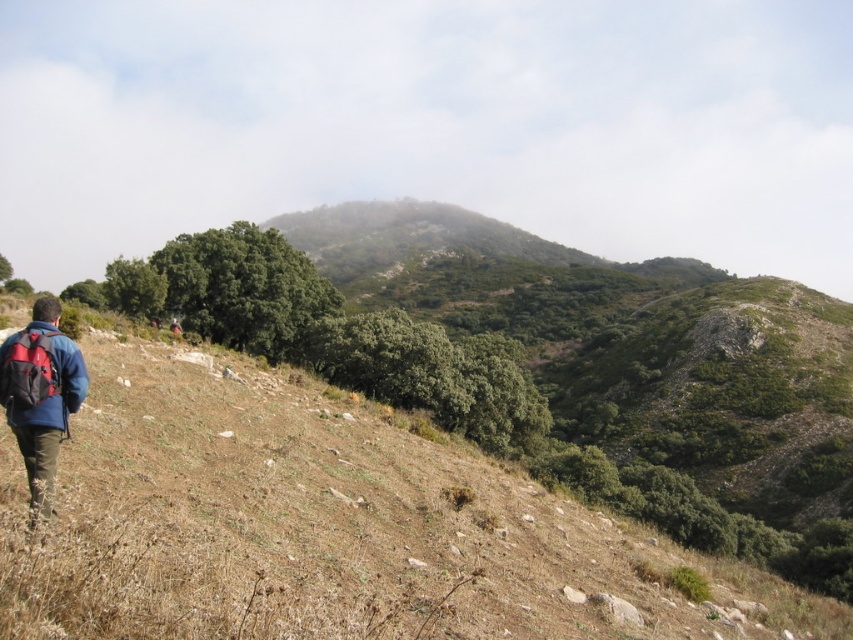
You are the hiker in the image. You want to place your red fabric backpack at lower left on the ground near your blue fabric jacket at lower left. Is the backpack currently above or below the jacket?

The blue fabric jacket at lower left is positioned under the red fabric backpack at lower left, meaning the backpack is currently above the jacket.

You are a hiker trying to navigate the steep hillside. You notice the brown grassy hillside at lower left and the blue fabric jacket at lower left. Which object is closer to you as you look towards the hill?

The brown grassy hillside at lower left is closer to the viewer than the blue fabric jacket at lower left, so the brown grassy hillside at lower left is closer to you.